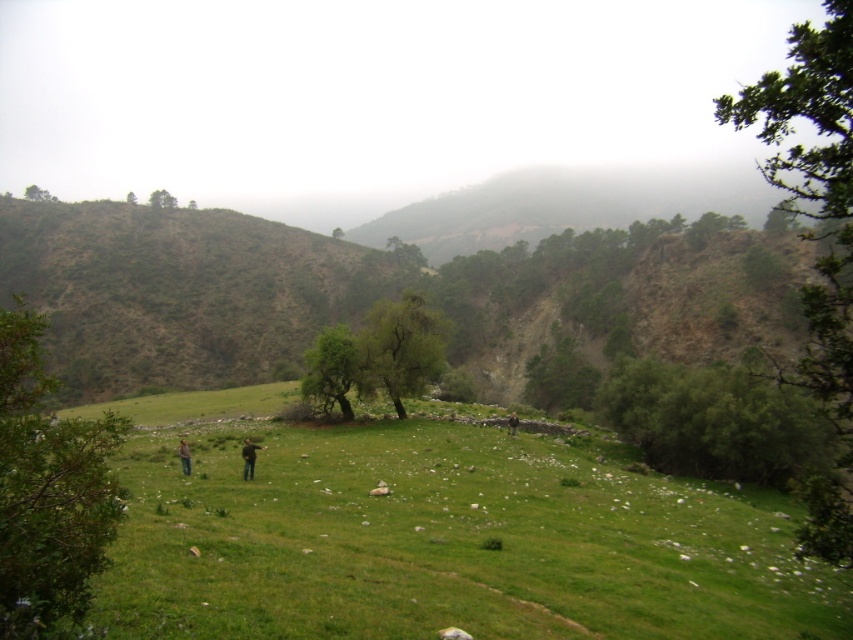
Question: Which point is farther from the camera taking this photo?

Choices:
 (A) (131, 202)
 (B) (323, 397)

Answer: (A)

Question: Is green grass at center to the left of green leafy tree at right from the viewer's perspective?

Choices:
 (A) yes
 (B) no

Answer: (A)

Question: Is green leafy tree at lower left bigger than dark brown leather jacket at center?

Choices:
 (A) yes
 (B) no

Answer: (A)

Question: Can you confirm if green leafy tree at lower left is positioned below dark brown leather jacket at center?

Choices:
 (A) no
 (B) yes

Answer: (A)

Question: Which point is closer to the camera taking this photo?

Choices:
 (A) pyautogui.click(x=180, y=444)
 (B) pyautogui.click(x=126, y=202)

Answer: (A)

Question: Among these points, which one is nearest to the camera?

Choices:
 (A) (x=822, y=518)
 (B) (x=189, y=456)
 (C) (x=132, y=195)
 (D) (x=167, y=204)

Answer: (A)